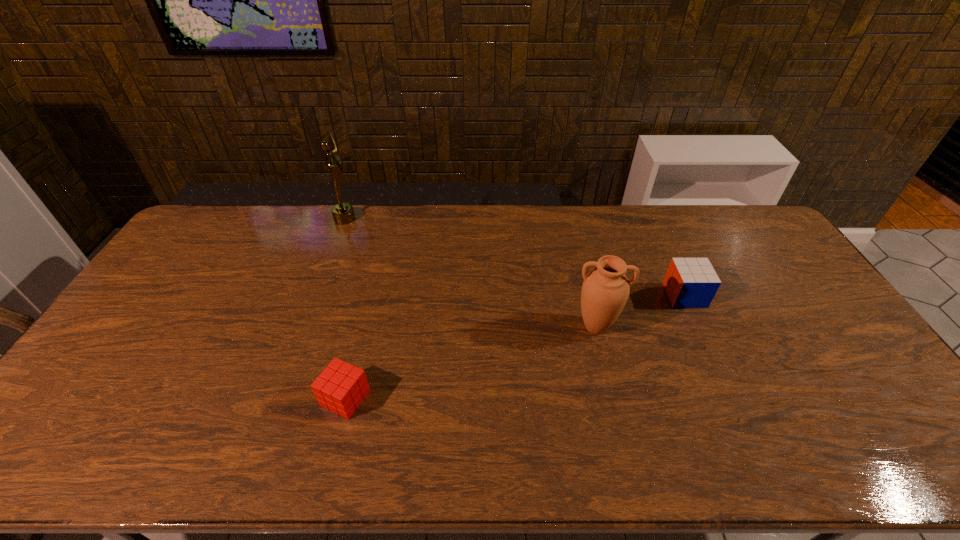
This screenshot has width=960, height=540. In order to click on free spot that satisfies the following two spatial constraints: 1. on the back side of the shorter cube; 2. on the front-facing side of the farthest object in this screenshot , I will do [x=390, y=219].

At what (x,y) coordinates should I click in order to perform the action: click on vacant space that satisfies the following two spatial constraints: 1. on the back side of the shorter cube; 2. on the left side of the second nearest object. Please return your answer as a coordinate pair (x, y). The image size is (960, 540). Looking at the image, I should click on (363, 327).

Identify the location of free space that satisfies the following two spatial constraints: 1. on the front-facing side of the farthest object; 2. on the right side of the nearest object. (278, 398).

Find the location of a particular element. This screenshot has width=960, height=540. free spot that satisfies the following two spatial constraints: 1. on the front-facing side of the farther cube; 2. on the left side of the leftmost object is located at coordinates (317, 295).

This screenshot has height=540, width=960. I want to click on free region that satisfies the following two spatial constraints: 1. on the front-facing side of the leftmost object; 2. on the left side of the rightmost object, so click(317, 295).

Locate an element on the screen. free point that satisfies the following two spatial constraints: 1. on the front-facing side of the second shortest object; 2. on the left side of the leftmost object is located at coordinates (317, 295).

At what (x,y) coordinates should I click in order to perform the action: click on vacant region that satisfies the following two spatial constraints: 1. on the back side of the third farthest object; 2. on the front-facing side of the tallest object. Please return your answer as a coordinate pair (x, y). The image size is (960, 540). Looking at the image, I should click on (569, 219).

Image resolution: width=960 pixels, height=540 pixels. Find the location of `vacant space that satisfies the following two spatial constraints: 1. on the front-facing side of the second tallest object; 2. on the right side of the farthest object`. vacant space that satisfies the following two spatial constraints: 1. on the front-facing side of the second tallest object; 2. on the right side of the farthest object is located at coordinates (305, 327).

Identify the location of free spot that satisfies the following two spatial constraints: 1. on the front-facing side of the leftmost object; 2. on the right side of the nearer cube. This screenshot has height=540, width=960. (278, 398).